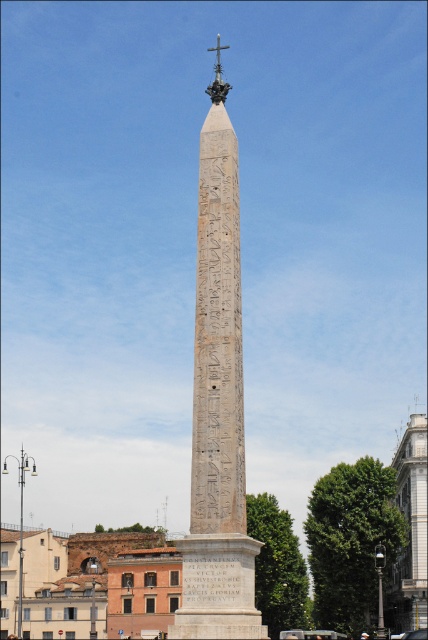
You are a photographer standing at a certain distance from the carved stone obelisk at center. You want to capture the entire structure in one frame without moving closer. According to the description, what is the minimum distance you should maintain from the obelisk to ensure it fits entirely in your camera frame?

The carved stone obelisk at center and camera are 43.87 meters apart, so maintaining a distance of at least 43.87 meters ensures the entire obelisk fits in the camera frame.

Looking at this image, you are an archaeologist examining the image of the obelisk. You notice a specific point marked at coordinates (217, 404). Where is the carved stone obelisk located in relation to this point?

The carved stone obelisk at center is located exactly at the point marked at coordinates (217, 404).

You are an architect designing a new plaza and want to place a statue between the carved stone obelisk at center and the white marble tower at right. The statue requires a minimum space of 3 meters between the two structures. Can you determine if there is enough space based on their widths?

The carved stone obelisk at center is wider than the white marble tower at right, but the question is about the distance between them, not their widths. The provided information does not mention the distance between the two structures, so it cannot be determined if the 3 meters requirement is met.